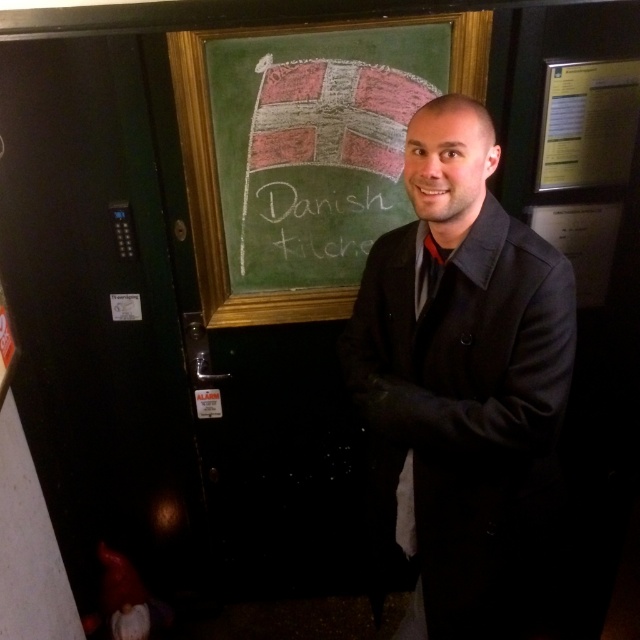
Question: Does dark gray wool coat at center appear under black satin tie at center?

Choices:
 (A) yes
 (B) no

Answer: (B)

Question: Which point appears farthest from the camera in this image?

Choices:
 (A) (426, 609)
 (B) (332, 220)
 (C) (464, 52)

Answer: (B)

Question: Which point is closer to the camera taking this photo?

Choices:
 (A) (426, 250)
 (B) (339, 256)
 (C) (205, 252)

Answer: (A)

Question: Does white chalk writing at center come in front of black satin tie at center?

Choices:
 (A) yes
 (B) no

Answer: (B)

Question: Is green chalkboard at center above white chalk writing at center?

Choices:
 (A) no
 (B) yes

Answer: (B)

Question: Which point is closer to the camera?

Choices:
 (A) black satin tie at center
 (B) dark gray wool coat at center
 (C) green chalkboard at center
 (D) white chalk writing at center

Answer: (B)